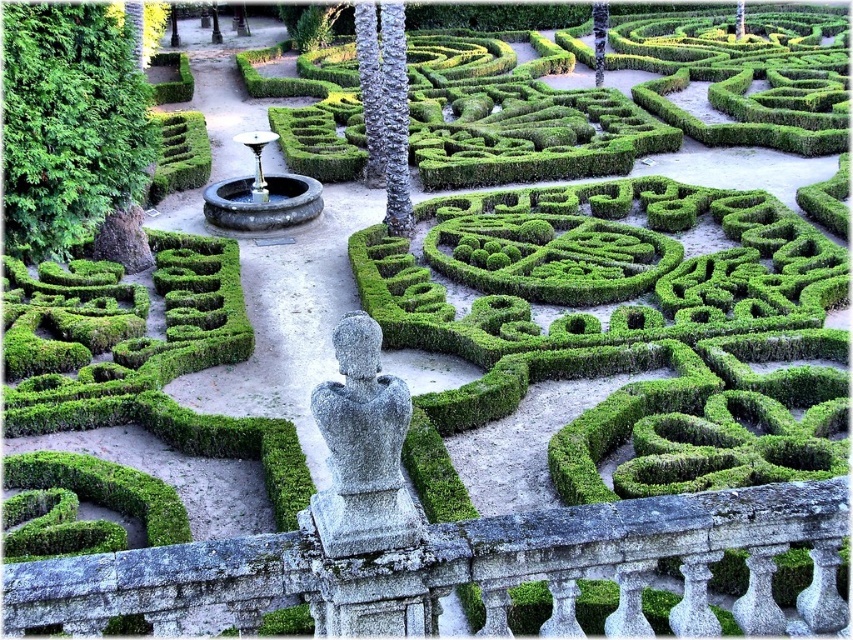
Does gray stone statue at center have a lesser width compared to black stone fountain at center?

Correct, gray stone statue at center's width is less than black stone fountain at center's.

Who is higher up, gray stone statue at center or black stone fountain at center?

black stone fountain at center

The image size is (853, 640). In order to click on gray stone statue at center in this screenshot , I will do `click(363, 449)`.

At what (x,y) coordinates should I click in order to perform the action: click on gray stone statue at center. Please return your answer as a coordinate pair (x, y). The height and width of the screenshot is (640, 853). Looking at the image, I should click on (363, 449).

Between green leafy bush at left and black stone fountain at center, which one appears on the left side from the viewer's perspective?

Positioned to the left is green leafy bush at left.

Who is more distant from viewer, (x=136, y=161) or (x=311, y=212)?

The point (x=311, y=212) is behind.

Find the location of a particular element. green leafy bush at left is located at coordinates (70, 124).

Is green leafy bush at left bigger than gray stone statue at center?

Indeed, green leafy bush at left has a larger size compared to gray stone statue at center.

Does point (129, 170) come closer to viewer compared to point (379, 513)?

No, it is behind (379, 513).

Image resolution: width=853 pixels, height=640 pixels. What do you see at coordinates (70, 124) in the screenshot?
I see `green leafy bush at left` at bounding box center [70, 124].

Locate an element on the screen. The width and height of the screenshot is (853, 640). green leafy bush at left is located at coordinates (70, 124).